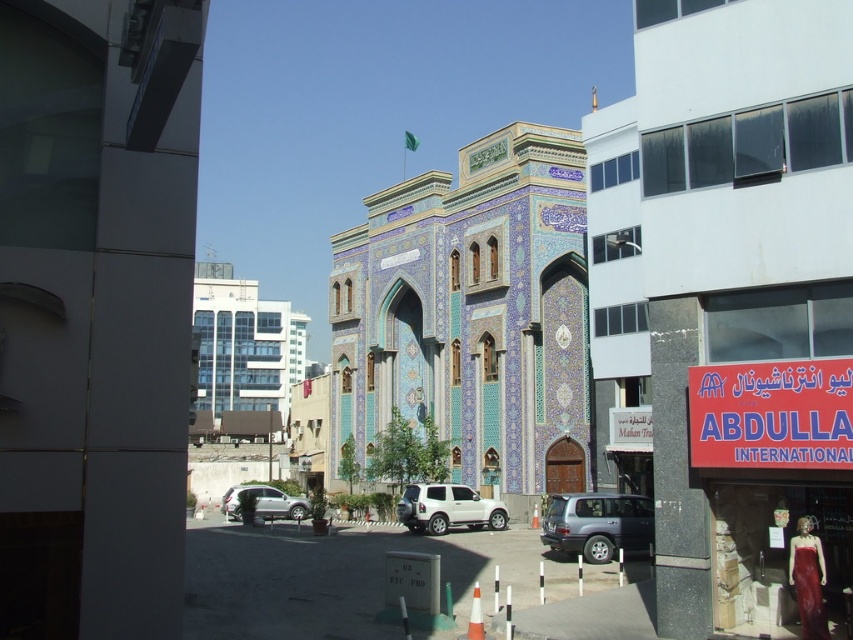
You are a delivery driver approaching the blue mosaic mosque at center and the metallic silver suv at center. Based on the scene, which object is positioned higher from the ground?

The blue mosaic mosque at center is positioned higher from the ground than the metallic silver suv at center because it is described as being above it.

You are standing at the entrance of the blue mosaic mosque at center and want to locate the nearest traffic cone. Which direction should you walk to reach it?

The nearest traffic cone is located to the left of the blue mosaic mosque at center.

You are a delivery driver who needs to park your vehicle in this area. You have two options for parking spots near the metallic silver suv at center and the silver metallic suv at lower center. Which parking spot would allow your vehicle to fit better without overlapping other objects?

The parking spot near the silver metallic suv at lower center would allow your vehicle to fit better since it occupies more space than the metallic silver suv at center.